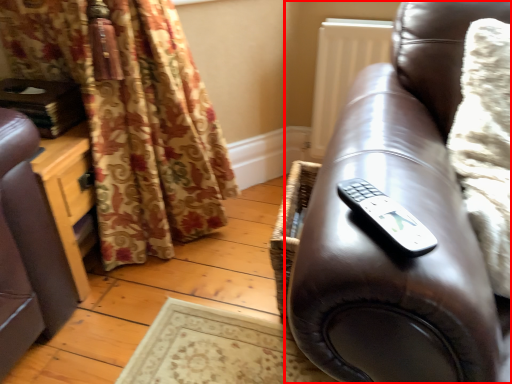
Question: From the image, what is the correct spatial relationship of studio couch (annotated by the red box) in relation to remote?

Choices:
 (A) right
 (B) left

Answer: (A)